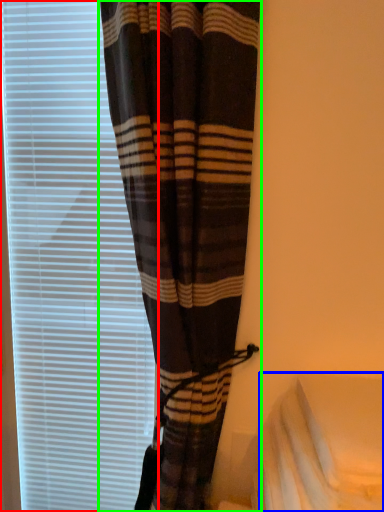
Question: Which object is the farthest from window blind (highlighted by a red box)? Choose among these: sheet (highlighted by a blue box) or curtain (highlighted by a green box).

Choices:
 (A) sheet
 (B) curtain

Answer: (A)